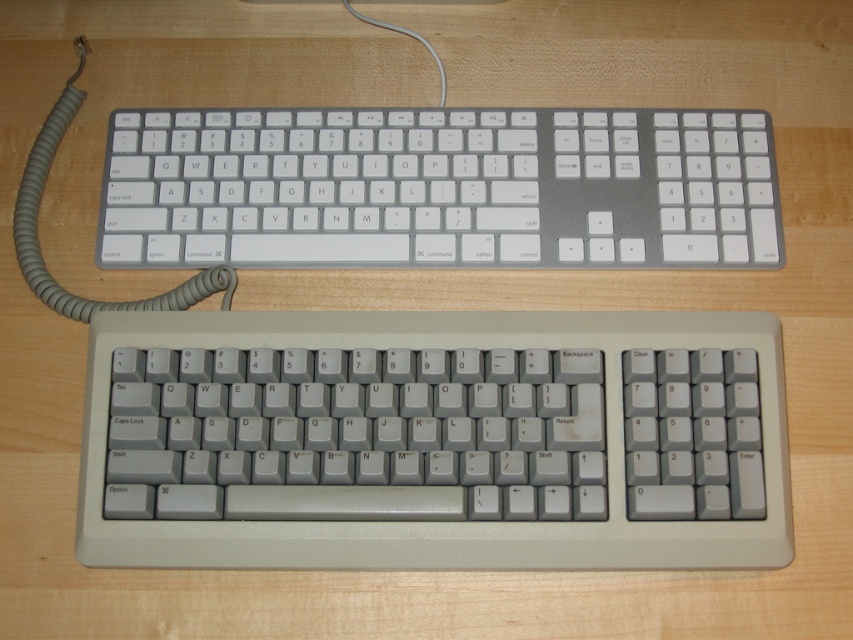
Question: Among these points, which one is nearest to the camera?

Choices:
 (A) (181, 256)
 (B) (764, 497)
 (C) (82, 68)

Answer: (B)

Question: In this image, where is gray plastic keyboard at center located relative to gray rubberized cord at upper left?

Choices:
 (A) right
 (B) left

Answer: (A)

Question: Estimate the real-world distances between objects in this image. Which object is closer to the white plastic keyboard at center?

Choices:
 (A) gray plastic keyboard at center
 (B) gray rubberized cord at upper left

Answer: (A)

Question: Which object is the farthest from the white plastic keyboard at center?

Choices:
 (A) gray plastic keyboard at center
 (B) gray rubberized cord at upper left

Answer: (B)

Question: Is white plastic keyboard at center thinner than gray rubberized cord at upper left?

Choices:
 (A) yes
 (B) no

Answer: (B)

Question: Does white plastic keyboard at center appear on the right side of gray rubberized cord at upper left?

Choices:
 (A) yes
 (B) no

Answer: (A)